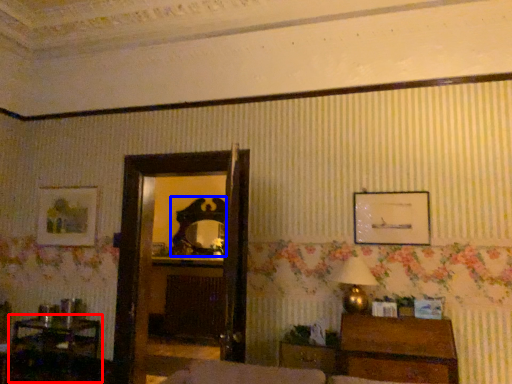
Question: Among these objects, which one is nearest to the camera, table (highlighted by a red box) or mirror (highlighted by a blue box)?

Choices:
 (A) table
 (B) mirror

Answer: (A)